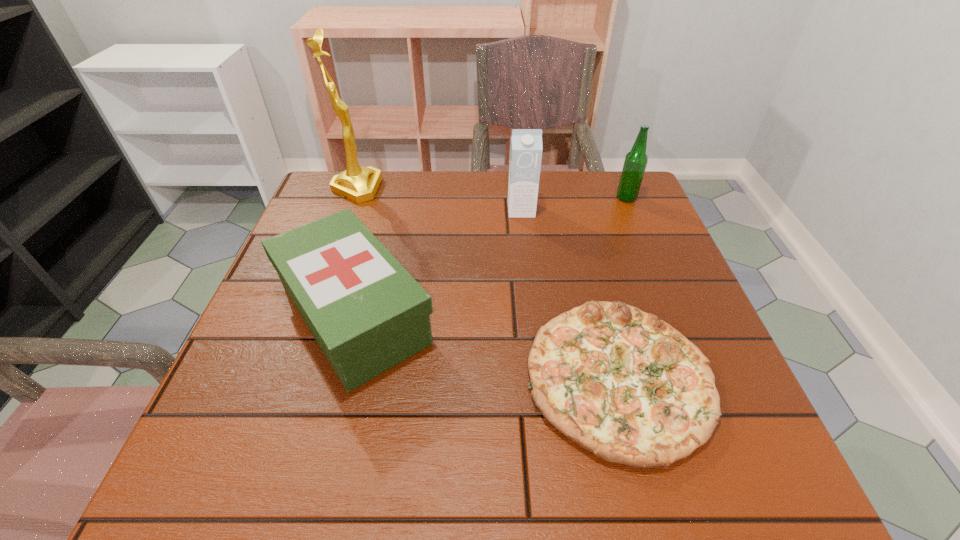
Where is `unoccupied position between the carton and the tallest object`? unoccupied position between the carton and the tallest object is located at coordinates (439, 199).

The height and width of the screenshot is (540, 960). I want to click on vacant area that lies between the carton and the award, so click(x=439, y=199).

Find the location of `vacant space that's between the pizza and the tallest object`. vacant space that's between the pizza and the tallest object is located at coordinates click(x=488, y=283).

This screenshot has width=960, height=540. What are the coordinates of `vacant area that lies between the beer bottle and the carton` in the screenshot? It's located at (574, 204).

At what (x,y) coordinates should I click in order to perform the action: click on empty location between the tallest object and the shortest object. Please return your answer as a coordinate pair (x, y). The height and width of the screenshot is (540, 960). Looking at the image, I should click on (488, 283).

At what (x,y) coordinates should I click in order to perform the action: click on free space between the beer bottle and the award. Please return your answer as a coordinate pair (x, y). Looking at the image, I should click on (492, 193).

Where is `free spot between the beer bottle and the award`? The image size is (960, 540). free spot between the beer bottle and the award is located at coordinates (492, 193).

Locate an element on the screen. This screenshot has height=540, width=960. free space between the pizza and the carton is located at coordinates [570, 294].

The width and height of the screenshot is (960, 540). I want to click on free space between the shortest object and the beer bottle, so click(x=622, y=288).

Where is `object that is the second closest one to the shortest object`? object that is the second closest one to the shortest object is located at coordinates (526, 148).